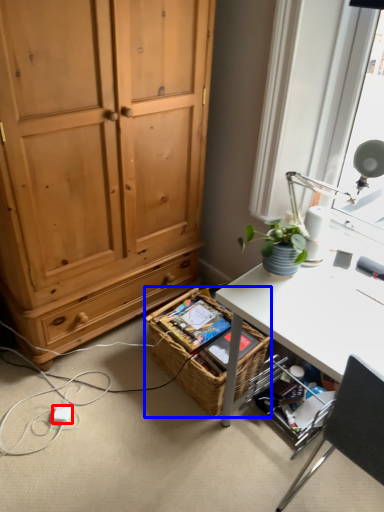
Question: Which point is further to the camera, power outlet (highlighted by a red box) or picnic basket (highlighted by a blue box)?

Choices:
 (A) power outlet
 (B) picnic basket

Answer: (A)